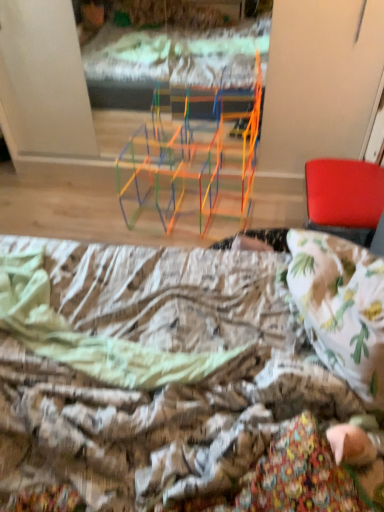
Question: Should I look upward or downward to see printed fabric bed at lower center?

Choices:
 (A) up
 (B) down

Answer: (B)

Question: Are red leather chair at right and printed fabric bed at lower center located far from each other?

Choices:
 (A) yes
 (B) no

Answer: (B)

Question: Is red leather chair at right thinner than printed fabric bed at lower center?

Choices:
 (A) yes
 (B) no

Answer: (A)

Question: Considering the relative sizes of red leather chair at right and printed fabric bed at lower center in the image provided, is red leather chair at right bigger than printed fabric bed at lower center?

Choices:
 (A) no
 (B) yes

Answer: (A)

Question: Is red leather chair at right positioned with its back to printed fabric bed at lower center?

Choices:
 (A) yes
 (B) no

Answer: (B)

Question: Is red leather chair at right shorter than printed fabric bed at lower center?

Choices:
 (A) no
 (B) yes

Answer: (A)

Question: From the image's perspective, would you say red leather chair at right is shown under printed fabric bed at lower center?

Choices:
 (A) yes
 (B) no

Answer: (B)

Question: Can you confirm if printed fabric bed at lower center is smaller than red leather chair at right?

Choices:
 (A) yes
 (B) no

Answer: (B)

Question: Can you confirm if printed fabric bed at lower center is thinner than red leather chair at right?

Choices:
 (A) yes
 (B) no

Answer: (B)

Question: Can red leather chair at right be found inside printed fabric bed at lower center?

Choices:
 (A) yes
 (B) no

Answer: (B)

Question: Does printed fabric bed at lower center lie behind red leather chair at right?

Choices:
 (A) no
 (B) yes

Answer: (A)

Question: Considering the relative positions of printed fabric bed at lower center and red leather chair at right in the image provided, is printed fabric bed at lower center to the left of red leather chair at right from the viewer's perspective?

Choices:
 (A) no
 (B) yes

Answer: (B)

Question: From a real-world perspective, is printed fabric bed at lower center physically above red leather chair at right?

Choices:
 (A) yes
 (B) no

Answer: (A)

Question: Is point (317, 180) closer or farther from the camera than point (281, 432)?

Choices:
 (A) closer
 (B) farther

Answer: (B)